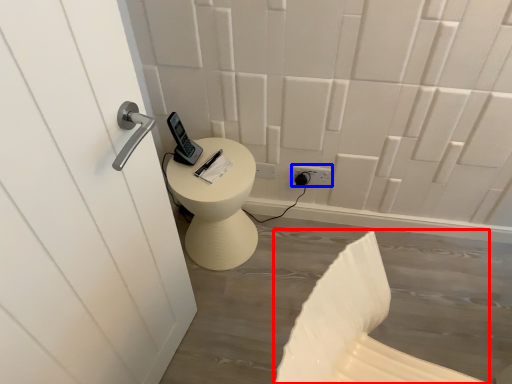
Question: Which of the following is the farthest to the observer, swivel chair (highlighted by a red box) or electric outlet (highlighted by a blue box)?

Choices:
 (A) swivel chair
 (B) electric outlet

Answer: (B)